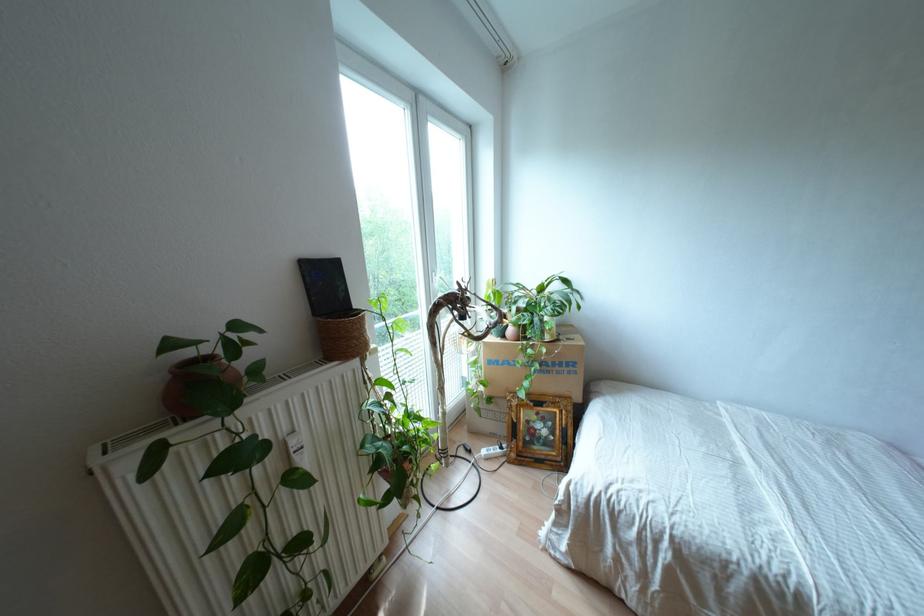
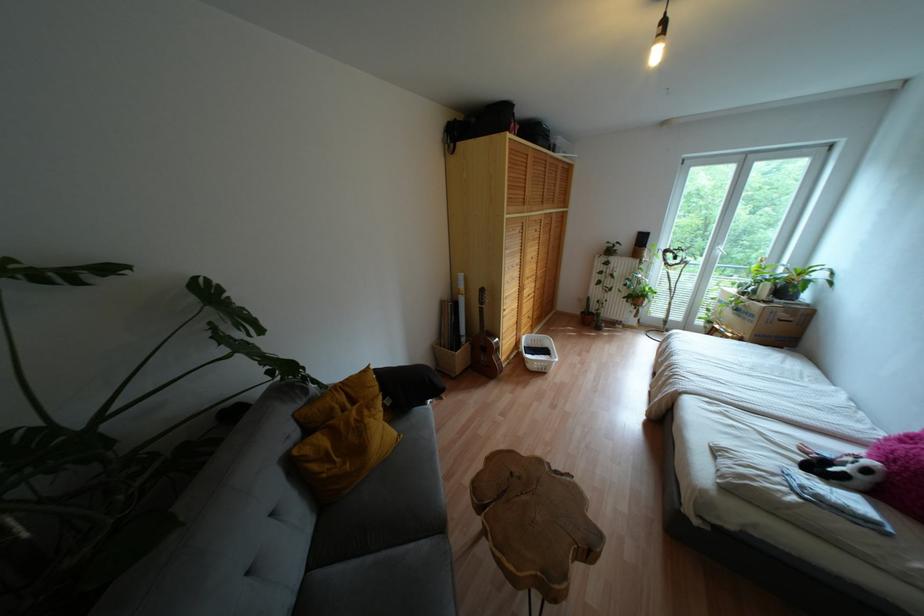
Locate, in the second image, the point that corresponds to [548,371] in the first image.

(737, 315)